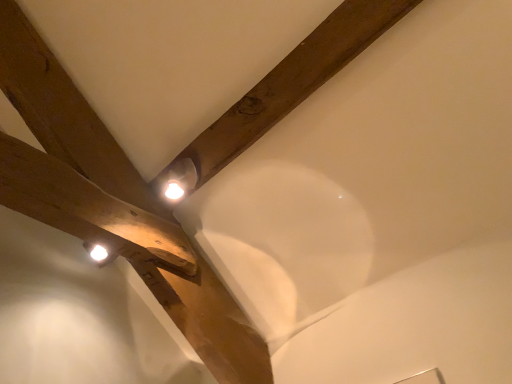
This screenshot has width=512, height=384. Find the location of `matte white lamp at upper center`. matte white lamp at upper center is located at coordinates (178, 180).

What do you see at coordinates (178, 180) in the screenshot?
I see `matte white lamp at upper center` at bounding box center [178, 180].

Identify the location of matte white lamp at upper center. This screenshot has width=512, height=384. (178, 180).